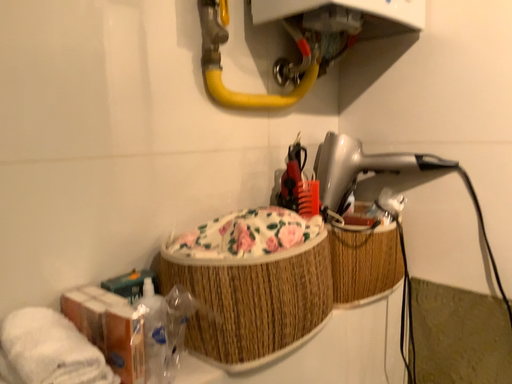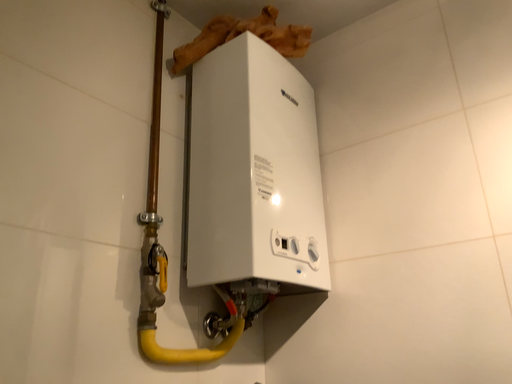
Question: How did the camera likely rotate when shooting the video?

Choices:
 (A) rotated downward
 (B) rotated upward

Answer: (B)